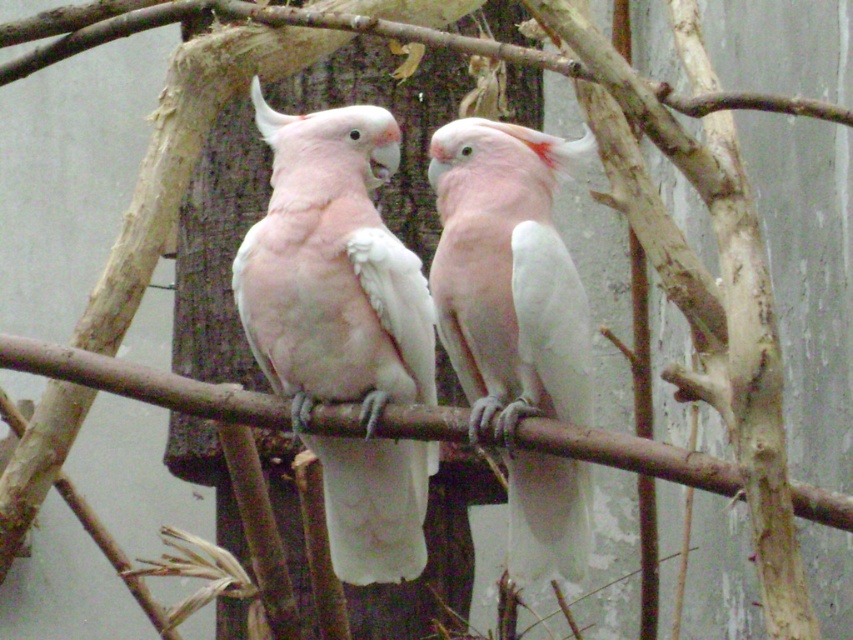
Does pink feathered parrot at center appear on the right side of white feathered parrot at center?

Incorrect, pink feathered parrot at center is not on the right side of white feathered parrot at center.

Is pink feathered parrot at center bigger than white feathered parrot at center?

Yes.

Between point (349, 563) and point (477, 262), which one is positioned behind?

The point (349, 563) is more distant.

You are a GUI agent. You are given a task and a screenshot of the screen. Output one action in this format:
    pyautogui.click(x=<x>, y=<y>)
    Task: Click on the pink feathered parrot at center
    
    Given the screenshot: What is the action you would take?
    pyautogui.click(x=343, y=324)